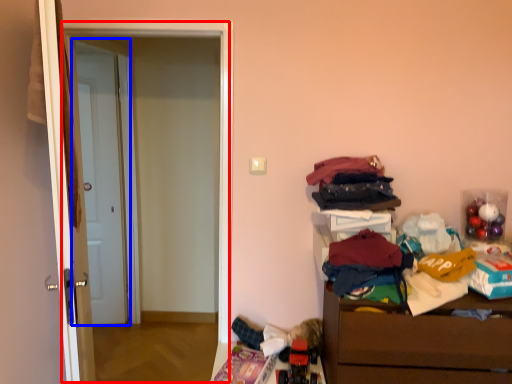
Question: Among these objects, which one is farthest to the camera, screen door (highlighted by a red box) or door (highlighted by a blue box)?

Choices:
 (A) screen door
 (B) door

Answer: (B)